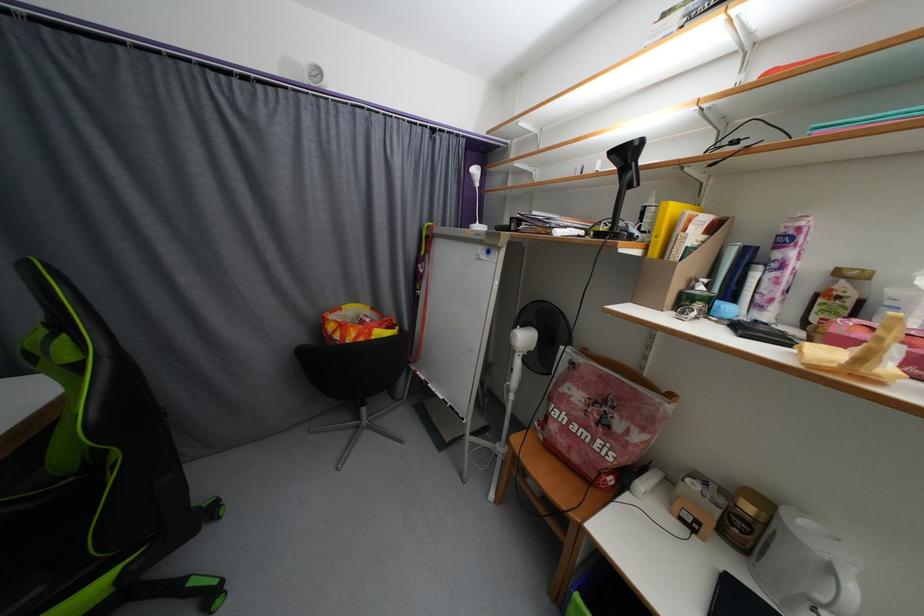
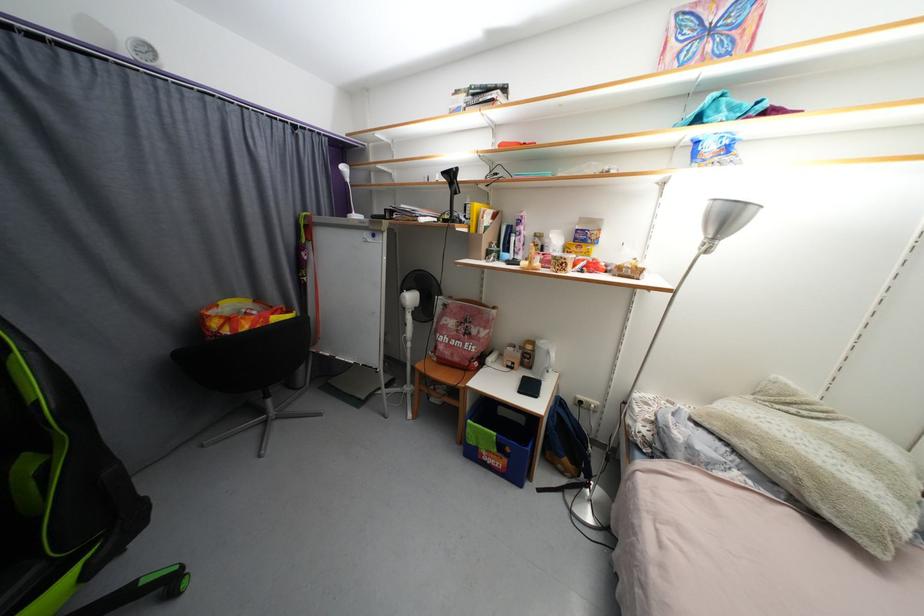
In the second image, find the point that corresponds to [483,229] in the first image.

(360, 217)